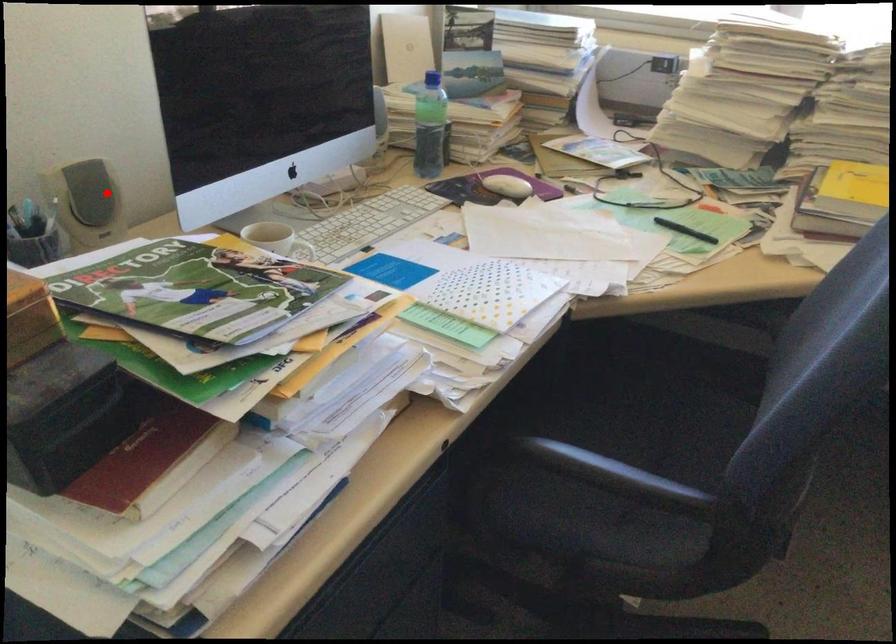
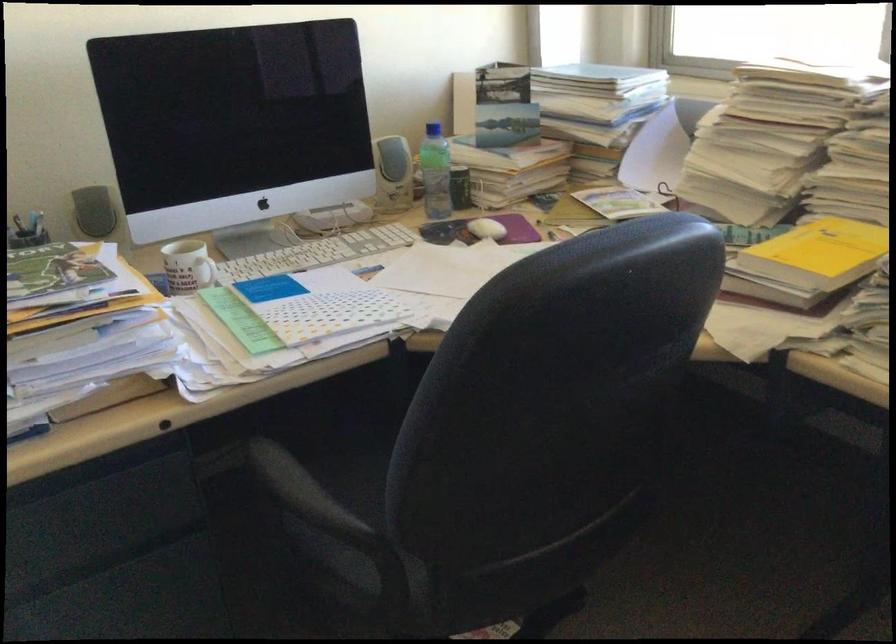
Question: I am providing you with two images of the same scene from different viewpoints. In image1, a red point is highlighted. Considering the same 3D point in image2, which of the following is correct?

Choices:
 (A) It is closer
 (B) It is farther

Answer: (B)